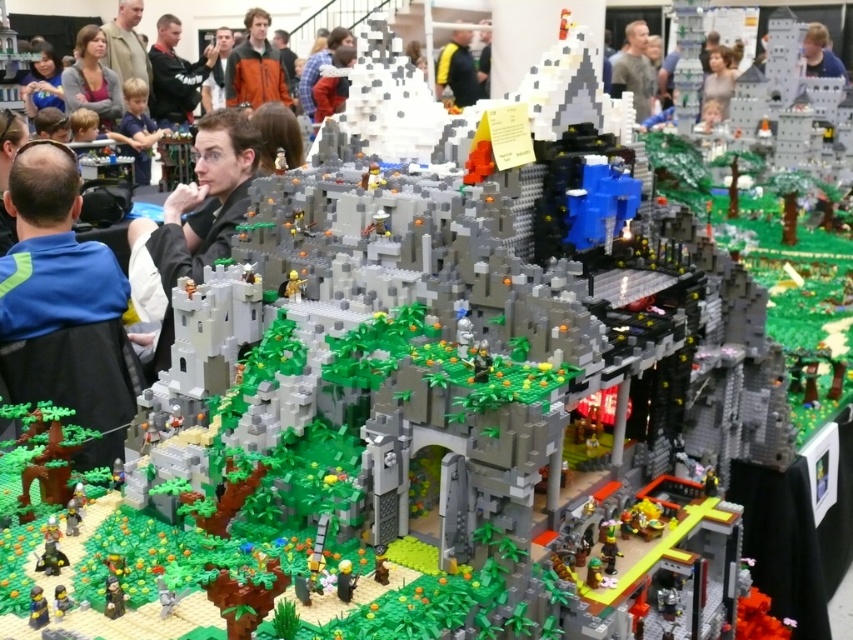
You are standing at the entrance of the cave in the LEGO mountain model. You notice two points marked on the ground. The first point is at coordinate point (134, 234), and the second is at point (90, 80). If you want to move towards the point that is closer to the cave entrance, which coordinate should you head towards?

Point (90, 80) is closer to the cave entrance because it is behind point (134, 234), which means it is nearer to the entrance from the observer standing at the entrance.